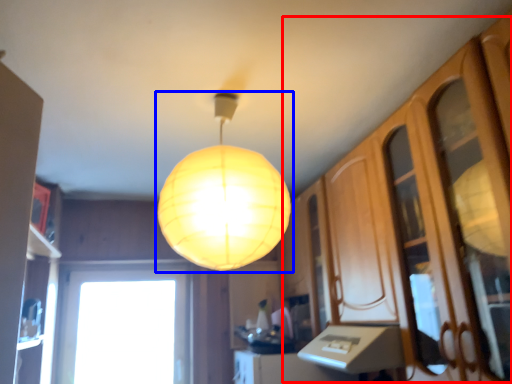
Question: Which object appears closest to the camera in this image, dresser (highlighted by a red box) or lamp (highlighted by a blue box)?

Choices:
 (A) dresser
 (B) lamp

Answer: (A)